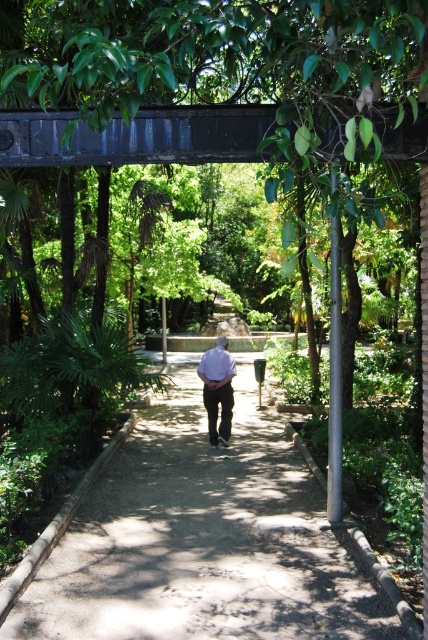
Question: Which point is closer to the camera taking this photo?

Choices:
 (A) (213, 369)
 (B) (249, 365)

Answer: (A)

Question: Is brown concrete pavement at center bigger than light purple shirt at center?

Choices:
 (A) yes
 (B) no

Answer: (A)

Question: Observing the image, what is the correct spatial positioning of brown concrete pavement at center in reference to light purple shirt at center?

Choices:
 (A) left
 (B) right

Answer: (A)

Question: Which point is farther to the camera?

Choices:
 (A) (205, 394)
 (B) (306, 481)

Answer: (A)

Question: Which object is closer to the camera taking this photo?

Choices:
 (A) light purple shirt at center
 (B) brown concrete pavement at center

Answer: (B)

Question: Is brown concrete pavement at center to the left of light purple shirt at center from the viewer's perspective?

Choices:
 (A) yes
 (B) no

Answer: (A)